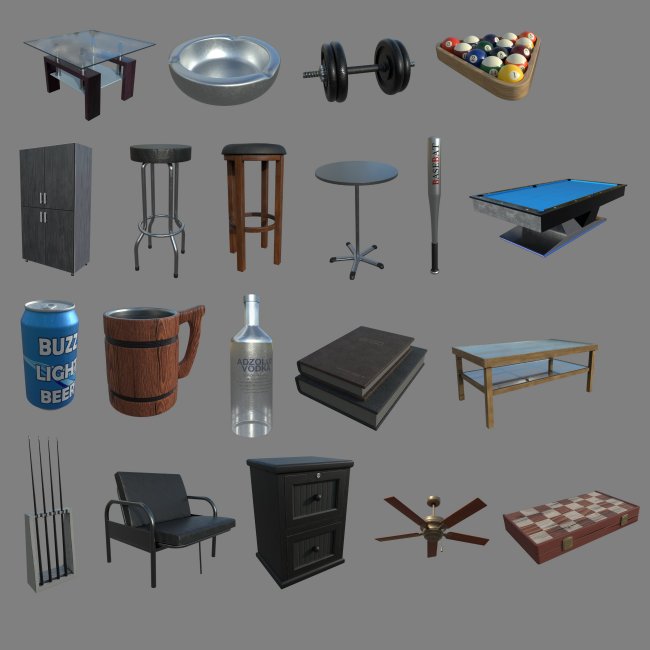
The image size is (650, 650). Identify the location of coffee table corners. (489, 361), (552, 335), (591, 346), (457, 340).